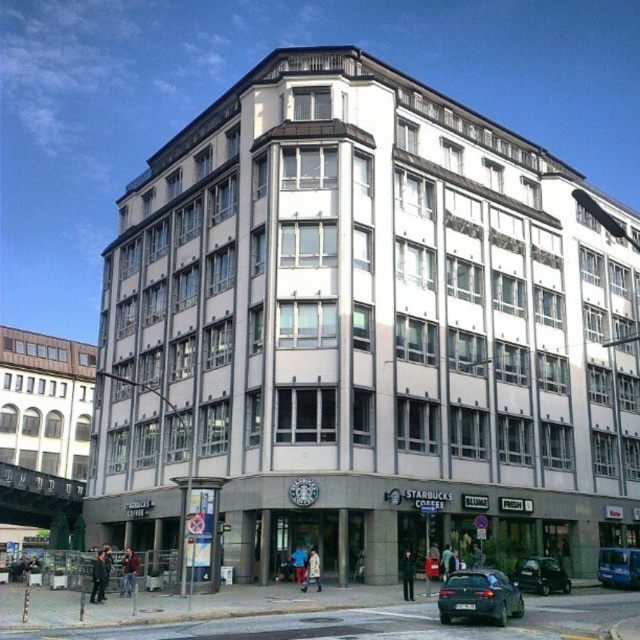
Question: Based on their relative distances, which object is nearer to the shiny black sedan at center?

Choices:
 (A) shiny black car at center
 (B) blue metallic van at center

Answer: (A)

Question: In this image, where is shiny black car at center located relative to blue metallic van at center?

Choices:
 (A) right
 (B) left

Answer: (B)

Question: Which object is the closest to the blue metallic van at center?

Choices:
 (A) shiny black car at center
 (B) shiny black sedan at center

Answer: (A)

Question: Which point is farther to the camera?

Choices:
 (A) shiny black car at center
 (B) shiny black sedan at center
 (C) blue metallic van at center

Answer: (C)

Question: Is shiny black car at center below blue metallic van at center?

Choices:
 (A) no
 (B) yes

Answer: (A)

Question: Does shiny black car at center appear on the right side of blue metallic van at center?

Choices:
 (A) no
 (B) yes

Answer: (A)